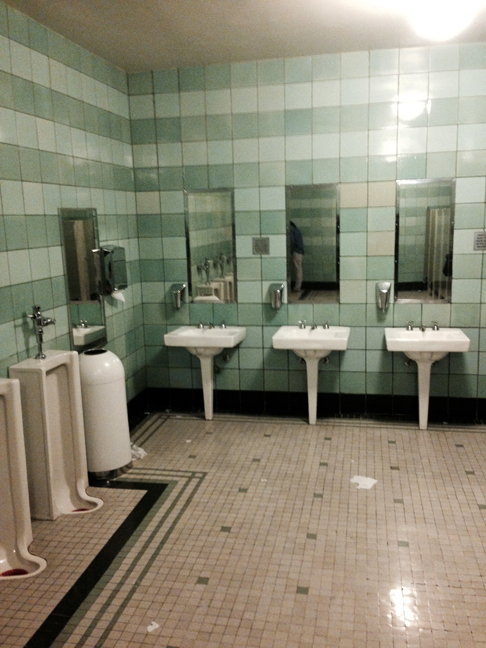
The image size is (486, 648). What are the coordinates of `air dryer` in the screenshot? It's located at (381, 295), (274, 294), (178, 292).